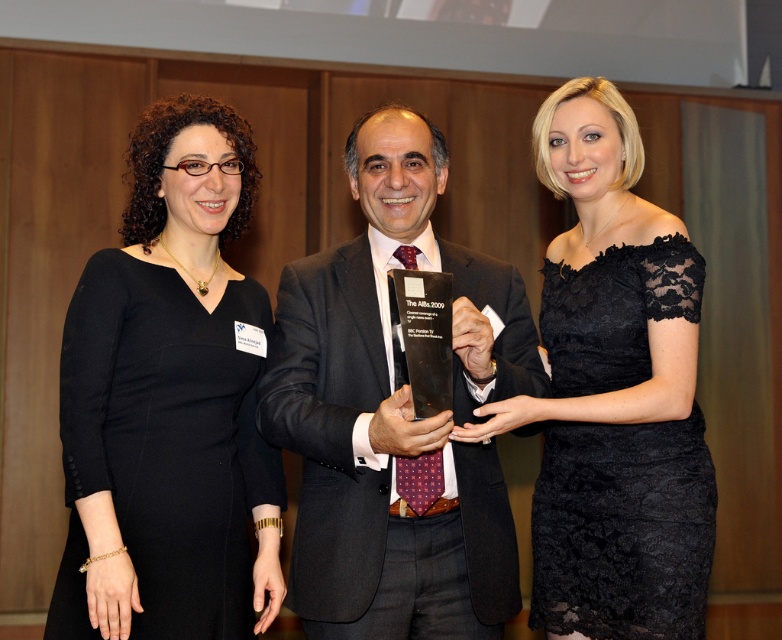
Can you confirm if black matte dress at left is shorter than black lace dress at center?

Yes.

Is point (248, 624) behind point (628, 211)?

No, it is not.

Find the location of `black matte dress at left`. black matte dress at left is located at coordinates (169, 401).

Does point (364, 316) lie in front of point (651, 593)?

No, it is not.

Is point (339, 461) farther from viewer compared to point (533, 419)?

No, it is not.

This screenshot has width=782, height=640. Identify the location of shiny black suit at center. (395, 413).

Who is more distant from viewer, [133,568] or [490,268]?

Point [490,268]

Is black matte dress at left in front of shiny black suit at center?

No, it is behind shiny black suit at center.

Does point (137, 349) lie behind point (303, 445)?

Yes, it is behind point (303, 445).

Locate an element on the screen. Image resolution: width=782 pixels, height=640 pixels. black matte dress at left is located at coordinates 169,401.